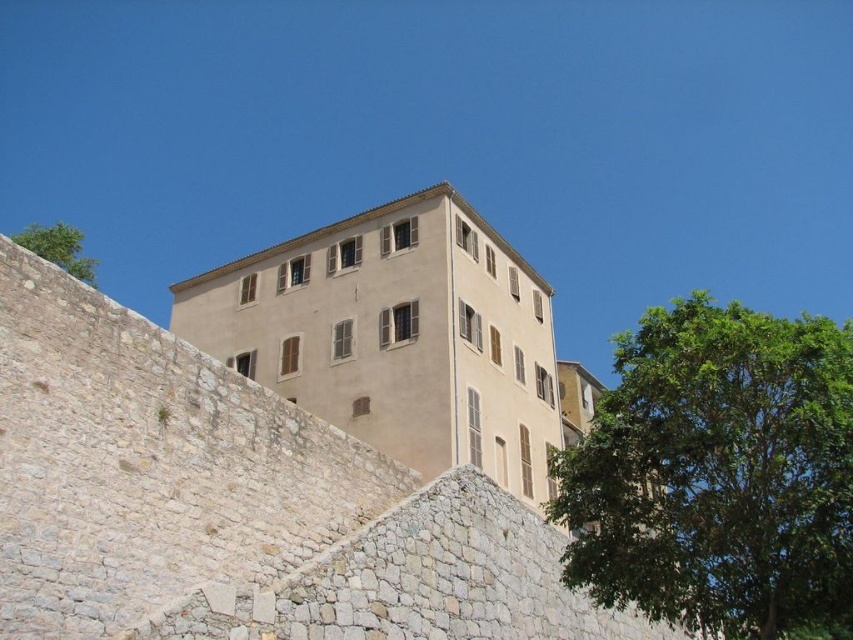
You are standing at the base of the multi story building and want to reach the point marked at coordinates point (782,428). Given that your maximum reach is 100 feet, can you reach that point without any assistance?

The point (782,428) is 101.32 feet away from the viewer, which exceeds your maximum reach of 100 feet. Therefore, you cannot reach it without assistance.

You are a painter standing in front of the beige stone wall at center and the green leafy tree at upper left. You want to paint the taller object first. Which one should you choose?

The green leafy tree at upper left is taller than the beige stone wall at center, so you should paint the green leafy tree at upper left first.